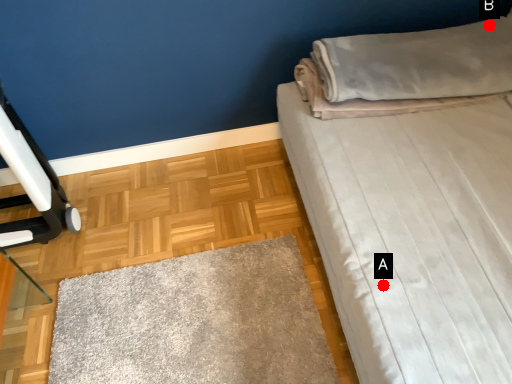
Question: Two points are circled on the image, labeled by A and B beside each circle. Among these points, which one is nearest to the camera?

Choices:
 (A) A is closer
 (B) B is closer

Answer: (A)